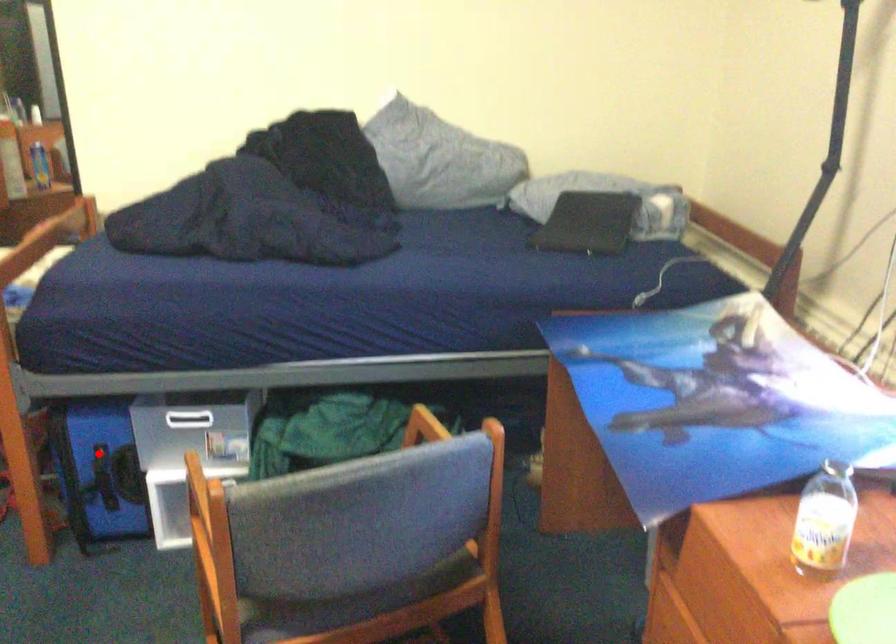
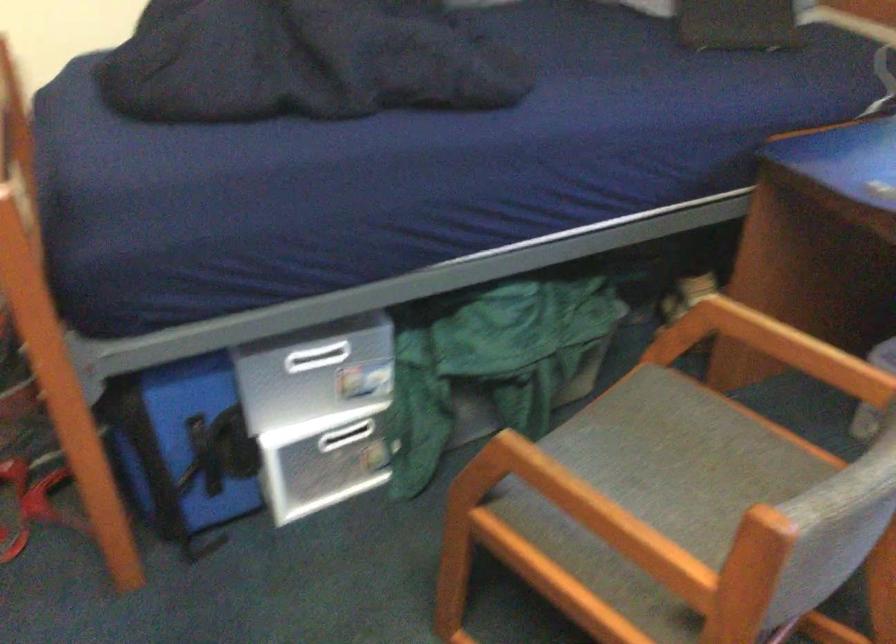
Question: I am providing you with two images of the same scene from different viewpoints. In image1, a red point is highlighted. Considering the same 3D point in image2, which of the following is correct?

Choices:
 (A) It is closer
 (B) It is farther

Answer: (A)